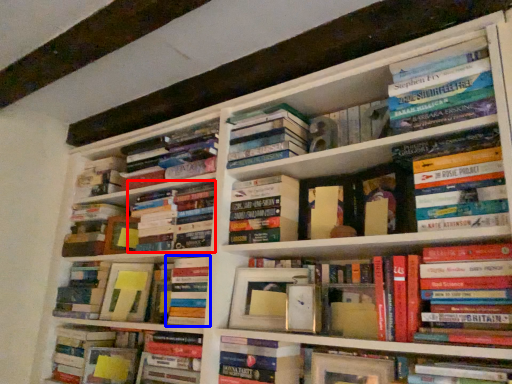
Question: Among these objects, which one is farthest to the camera, book (highlighted by a red box) or book (highlighted by a blue box)?

Choices:
 (A) book
 (B) book

Answer: (A)